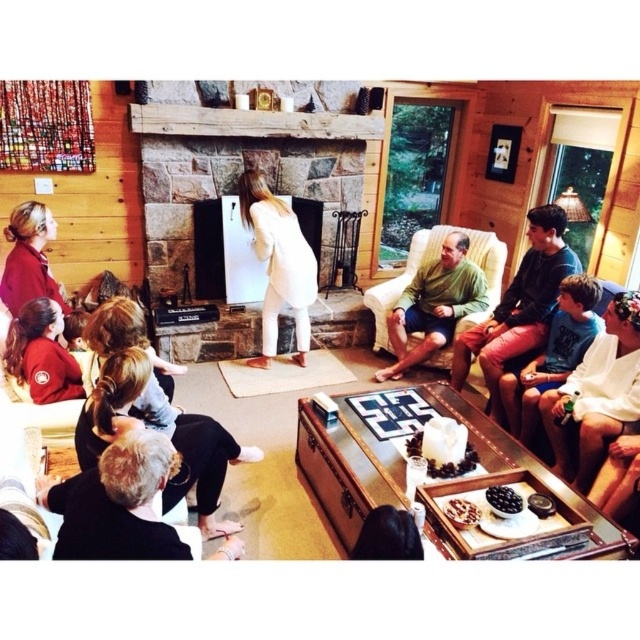
You are organizing a charity clothing drive and need to stack these two shirts neatly. Since the matte green shirt at center is covering the white cotton shirt at lower right, which shirt should you place on top to ensure both are visible?

The matte green shirt at center should be placed on top of the white cotton shirt at lower right to ensure both are visible, as it is already positioned over the white cotton shirt at lower right in the image.

You are a photographer taking a picture of the scene. You notice the blonde hair at lower left and the white matte dress at center. Which object is positioned lower in the image?

The blonde hair at lower left is positioned lower in the image than the white matte dress at center.